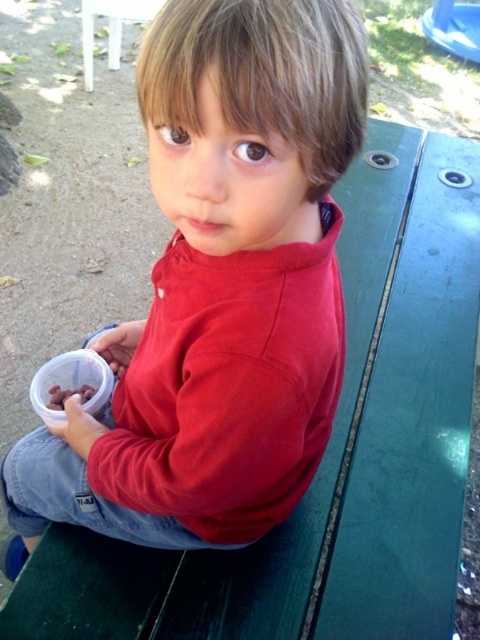
Question: In this image, where is matte red sweatshirt at center located relative to brown matte nuts at lower left?

Choices:
 (A) left
 (B) right

Answer: (B)

Question: Which point is farther to the camera?

Choices:
 (A) (331, 60)
 (B) (84, 401)

Answer: (B)

Question: Observing the image, what is the correct spatial positioning of matte red sweatshirt at center in reference to brown matte nuts at lower left?

Choices:
 (A) below
 (B) above

Answer: (A)

Question: Is matte red sweatshirt at center to the right of brown matte nuts at lower left from the viewer's perspective?

Choices:
 (A) yes
 (B) no

Answer: (A)